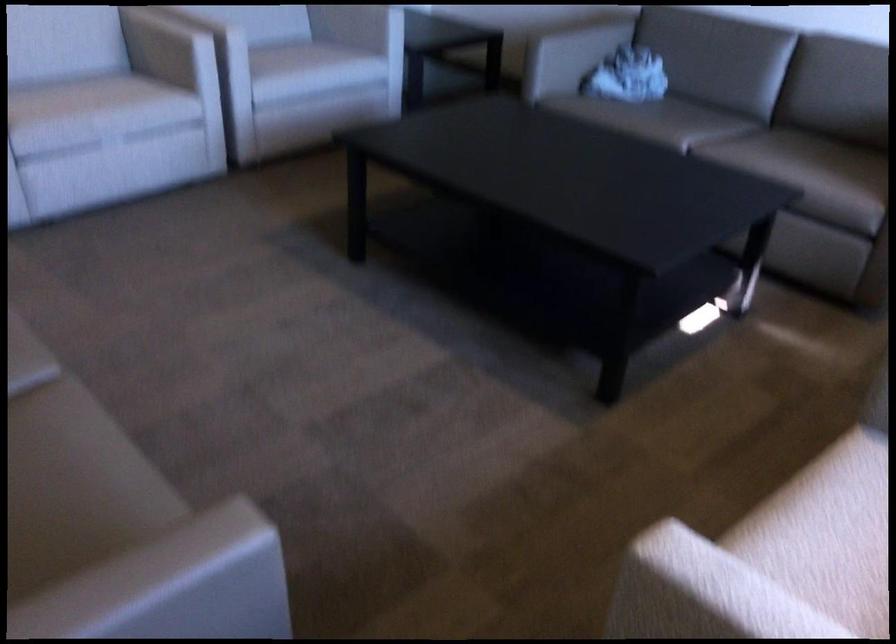
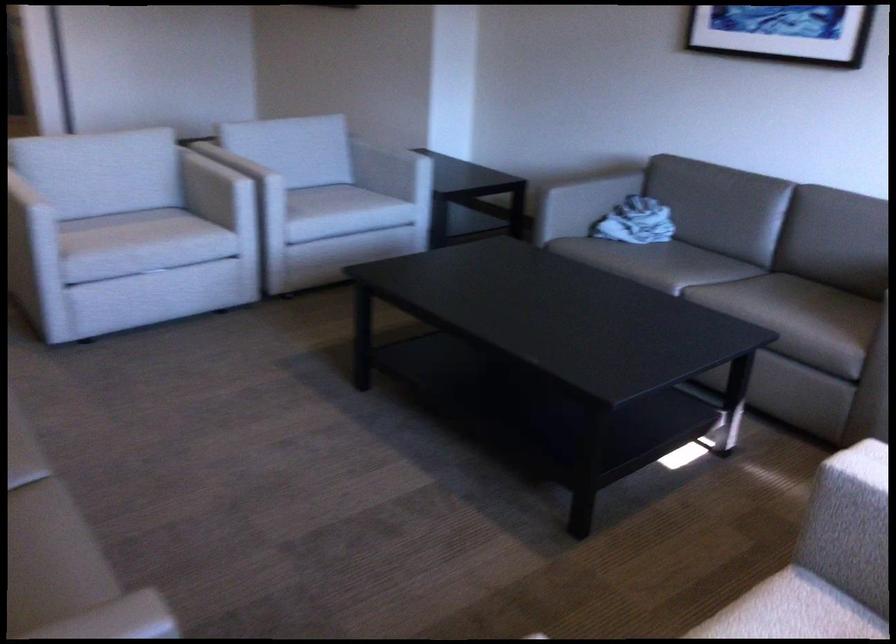
Question: How did the camera likely rotate?

Choices:
 (A) Left
 (B) Right
 (C) Up
 (D) Down

Answer: (C)